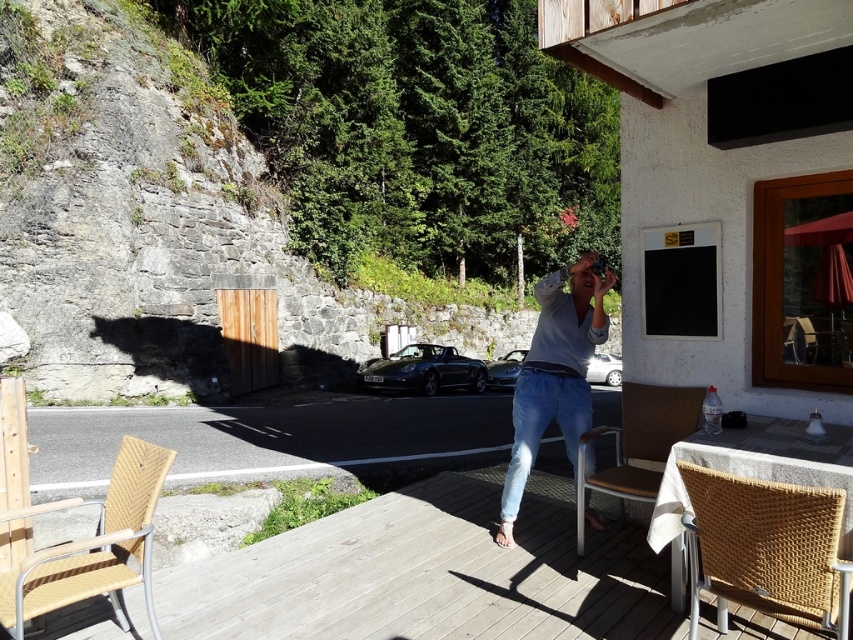
Question: Which of the following is the farthest from the observer?

Choices:
 (A) light blue denim jeans at center
 (B) woven rattan chair at lower right

Answer: (A)

Question: Does wooden deck at center have a smaller size compared to woven wood chair at lower left?

Choices:
 (A) yes
 (B) no

Answer: (B)

Question: Which of the following is the closest to the observer?

Choices:
 (A) brown woven chair at lower right
 (B) woven rattan chair at lower right
 (C) woven wood chair at lower left

Answer: (B)

Question: Is woven wood chair at lower left to the right of brown woven chair at lower right from the viewer's perspective?

Choices:
 (A) no
 (B) yes

Answer: (A)

Question: Which object is farther from the camera taking this photo?

Choices:
 (A) wooden deck at center
 (B) light blue denim jeans at center
 (C) brown woven chair at lower right

Answer: (B)

Question: Is woven rattan chair at lower right to the left of brown woven chair at lower right from the viewer's perspective?

Choices:
 (A) no
 (B) yes

Answer: (A)